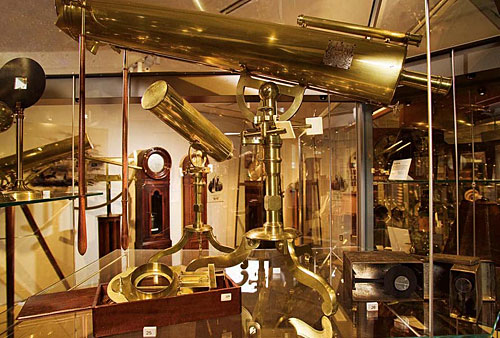
Where is `wall`? This screenshot has height=338, width=500. wall is located at coordinates [159, 135].